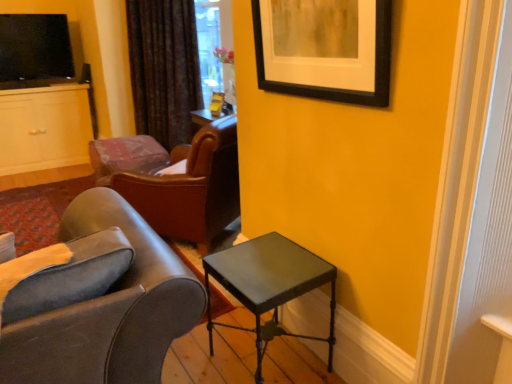
The width and height of the screenshot is (512, 384). What do you see at coordinates (325, 49) in the screenshot?
I see `black matte picture frame at upper right` at bounding box center [325, 49].

At what (x,y) coordinates should I click in order to perform the action: click on leather at center, marked as the first chair in a back-to-front arrangement. Please return your answer as a coordinate pair (x, y). Image resolution: width=512 pixels, height=384 pixels. Looking at the image, I should click on (125, 156).

Is point (64, 95) positioned behind point (246, 300)?

That is True.

Which of these two, matte white cabinet at left or metallic gray table at lower right, is bigger?

matte white cabinet at left.

Between matte white cabinet at left and metallic gray table at lower right, which one has less height?

With less height is metallic gray table at lower right.

Starting from the black matte picture frame at upper right, which chair is the 2nd one to the left? Please provide its 2D coordinates.

[(125, 156)]

Is point (131, 168) less distant than point (364, 31)?

No, (131, 168) is further to viewer.

Who is bigger, leather at center, marked as the first chair in a back-to-front arrangement, or black matte picture frame at upper right?

leather at center, marked as the first chair in a back-to-front arrangement, is bigger.

Is leather at center, acting as the 2th chair starting from the front, surrounding black matte picture frame at upper right?

Actually, black matte picture frame at upper right is outside leather at center, acting as the 2th chair starting from the front.

From a real-world perspective, is matte white cabinet at left physically below leather at left, the 1th chair when ordered from front to back?

Yes, from a real-world perspective, matte white cabinet at left is under leather at left, the 1th chair when ordered from front to back.

Is point (86, 148) positioned after point (186, 166)?

Yes, point (86, 148) is farther from viewer.

Is leather at left, positioned as the second chair in back-to-front order, oriented towards velvet dark brown curtain at upper center?

No, leather at left, positioned as the second chair in back-to-front order, is not facing towards velvet dark brown curtain at upper center.

Identify the location of chair that is the 1st one below the velvet dark brown curtain at upper center (from a real-world perspective). The width and height of the screenshot is (512, 384). 190,187.

Which is correct: leather at left, positioned as the second chair in back-to-front order, is inside velvet dark brown curtain at upper center, or outside of it?

leather at left, positioned as the second chair in back-to-front order, lies outside velvet dark brown curtain at upper center.

Between leather at left, positioned as the second chair in back-to-front order, and velvet dark brown curtain at upper center, which one has smaller size?

With smaller size is velvet dark brown curtain at upper center.

From the image's perspective, who appears lower, black matte picture frame at upper right or matte white cabinet at left?

black matte picture frame at upper right is shown below in the image.

From a real-world perspective, who is located higher, black matte picture frame at upper right or matte white cabinet at left?

From a 3D spatial view, black matte picture frame at upper right is above.

In the scene shown: Is black matte picture frame at upper right bigger than matte white cabinet at left?

Actually, black matte picture frame at upper right might be smaller than matte white cabinet at left.

Between black matte picture frame at upper right and matte white cabinet at left, which one is positioned in front?

Positioned in front is black matte picture frame at upper right.

Is metallic gray table at lower right smaller than velvet dark brown curtain at upper center?

Correct, metallic gray table at lower right occupies less space than velvet dark brown curtain at upper center.

Identify the location of table below the velvet dark brown curtain at upper center (from the image's perspective). (269, 285).

How distant is metallic gray table at lower right from velvet dark brown curtain at upper center?

9.75 feet.

Could you tell me if metallic gray table at lower right is facing velvet dark brown curtain at upper center?

No, metallic gray table at lower right is not aimed at velvet dark brown curtain at upper center.

Locate an element on the screen. The image size is (512, 384). picture frame that appears above the metallic gray table at lower right (from a real-world perspective) is located at coordinates (325, 49).

Which of these two, metallic gray table at lower right or black matte picture frame at upper right, is bigger?

metallic gray table at lower right.

Based on the photo, considering the relative sizes of metallic gray table at lower right and black matte picture frame at upper right in the image provided, is metallic gray table at lower right taller than black matte picture frame at upper right?

Yes.

Identify the location of entertainment center located above the metallic gray table at lower right (from the image's perspective). The image size is (512, 384). (42, 96).

Locate an element on the screen. The height and width of the screenshot is (384, 512). chair that is the 2nd object located behind the black matte picture frame at upper right is located at coordinates (125, 156).

When comparing their distances from black matte picture frame at upper right, does leather at left, the 1th chair when ordered from front to back, or velvet dark brown curtain at upper center seem further?

Based on the image, velvet dark brown curtain at upper center appears to be further to black matte picture frame at upper right.

Consider the image. Looking at the image, which one is located closer to metallic gray table at lower right, leather at left, positioned as the second chair in back-to-front order, or leather at center, marked as the first chair in a back-to-front arrangement?

Among the two, leather at left, positioned as the second chair in back-to-front order, is located nearer to metallic gray table at lower right.

Considering their positions, is black matte picture frame at upper right positioned closer to metallic gray table at lower right than leather at left, positioned as the second chair in back-to-front order?

Among the two, black matte picture frame at upper right is located nearer to metallic gray table at lower right.

Based on their spatial positions, is metallic gray table at lower right or leather at center, marked as the first chair in a back-to-front arrangement, closer to matte white cabinet at left?

leather at center, marked as the first chair in a back-to-front arrangement, is positioned closer to the anchor matte white cabinet at left.

Looking at the image, which one is located further to leather at center, acting as the 2th chair starting from the front, black matte picture frame at upper right or metallic gray table at lower right?

black matte picture frame at upper right is positioned further to the anchor leather at center, acting as the 2th chair starting from the front.

Estimate the real-world distances between objects in this image. Which object is further from black matte picture frame at upper right, metallic gray table at lower right or leather at center, marked as the first chair in a back-to-front arrangement?

leather at center, marked as the first chair in a back-to-front arrangement, is positioned further to the anchor black matte picture frame at upper right.

Which object lies further to the anchor point matte white cabinet at left, leather at left, positioned as the second chair in back-to-front order, or black matte picture frame at upper right?

black matte picture frame at upper right.

Looking at the image, which one is located closer to black matte picture frame at upper right, metallic gray table at lower right or velvet dark brown curtain at upper center?

metallic gray table at lower right lies closer to black matte picture frame at upper right than the other object.

Identify the location of chair positioned between black matte picture frame at upper right and leather at center, marked as the first chair in a back-to-front arrangement, from near to far. The image size is (512, 384). (190, 187).

Locate an element on the screen. The height and width of the screenshot is (384, 512). table positioned between black matte picture frame at upper right and leather at center, marked as the first chair in a back-to-front arrangement, from near to far is located at coordinates (269, 285).

I want to click on chair between metallic gray table at lower right and leather at center, acting as the 2th chair starting from the front, along the z-axis, so click(190, 187).

You are a GUI agent. You are given a task and a screenshot of the screen. Output one action in this format:
    pyautogui.click(x=<x>, y=<y>)
    Task: Click on the curtain between metallic gray table at lower right and matte white cabinet at left along the z-axis
    This screenshot has width=512, height=384.
    Given the screenshot: What is the action you would take?
    pyautogui.click(x=164, y=69)